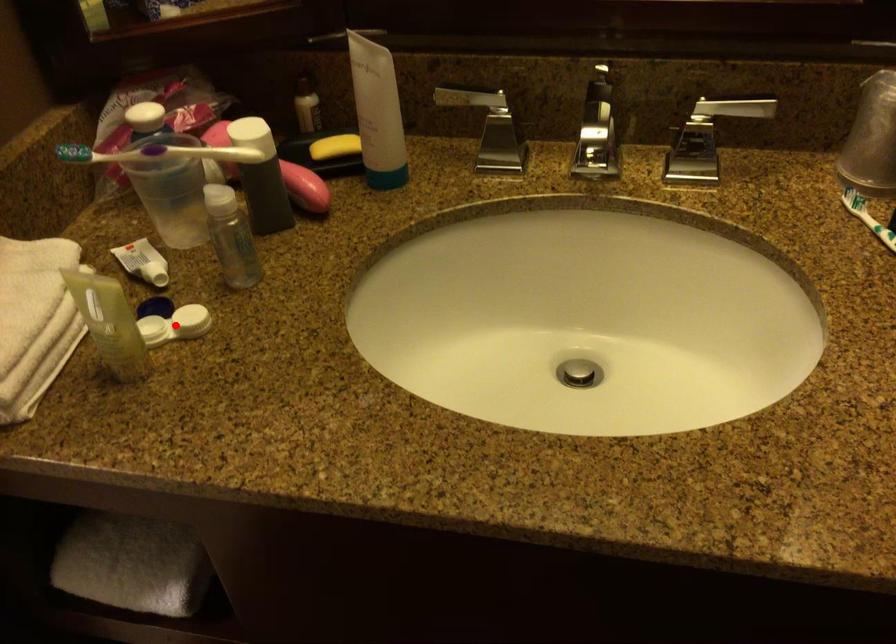
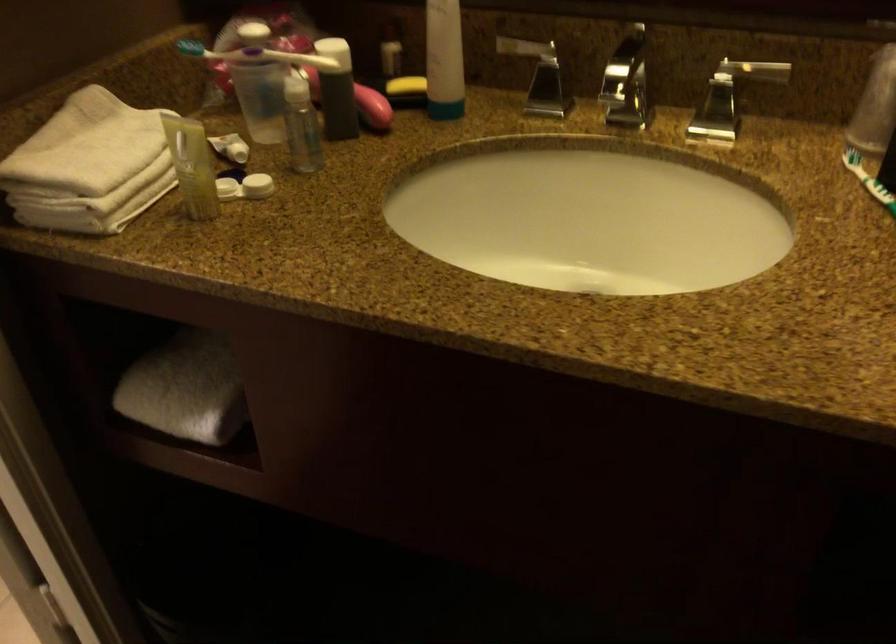
Question: I am providing you with two images of the same scene from different viewpoints. Image1 has a red point marked. In image2, the corresponding 3D location appears at what relative position? Reply with the corresponding letter.

Choices:
 (A) Closer
 (B) Farther

Answer: (B)